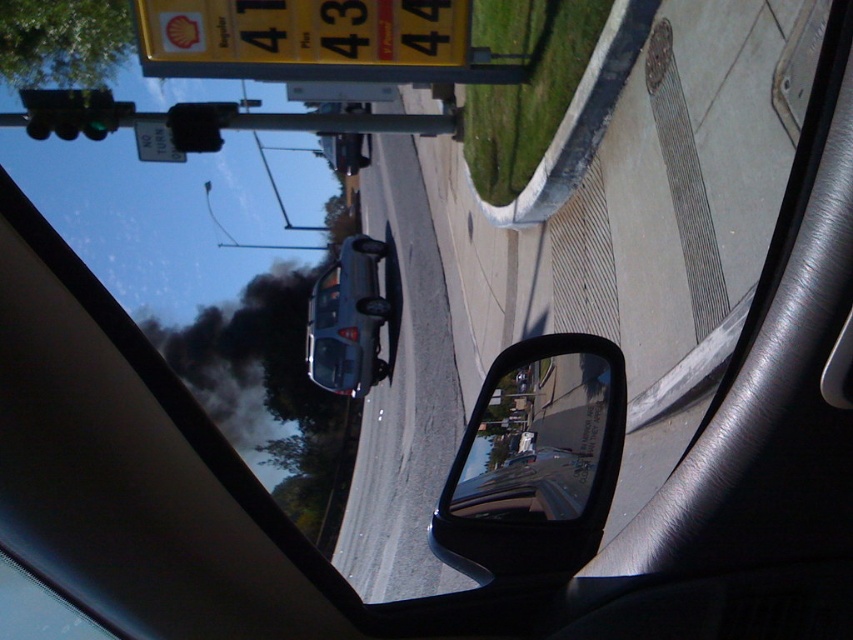
You are driving a car and see the satin silver sedan at center and the green glass traffic light at upper left in your view. Which object is taller in the image?

The satin silver sedan at center is taller than the green glass traffic light at upper left.

You are driving and see the black smoke at upper left and the black plastic traffic light at upper left in your car mirror. Which object is closer to your car?

The black smoke at upper left is closer to your car because it is further to the viewer than the black plastic traffic light at upper left in the mirror reflection.

Looking at this image, you are driving a car that is 15 feet long and need to make a U turn. The black glossy side mirror at lower right is attached to your car. The black plastic traffic light at upper left marks the start of a no U turn zone. Can you estimate whether your car can make a U turn before reaching the traffic light?

The distance between the black glossy side mirror at lower right and the black plastic traffic light at upper left is 42.80 feet. Since your car is 15 feet long, you have sufficient space to make a U turn before reaching the traffic light as 42.80 feet is more than enough for a standard U turn maneuver.